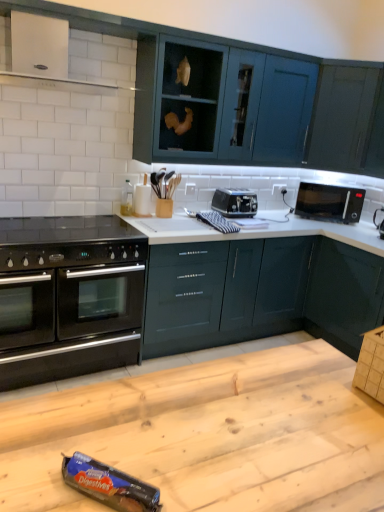
Where is `vacant space in between brown cardboard box at lower right and blue cardboard digestives at lower center, which is the first appliance in bottom-to-top order`? vacant space in between brown cardboard box at lower right and blue cardboard digestives at lower center, which is the first appliance in bottom-to-top order is located at coordinates (256, 437).